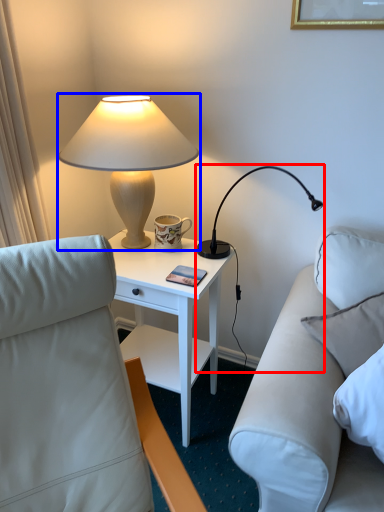
Question: Which point is further to the camera, lamp (highlighted by a red box) or lamp (highlighted by a blue box)?

Choices:
 (A) lamp
 (B) lamp

Answer: (A)